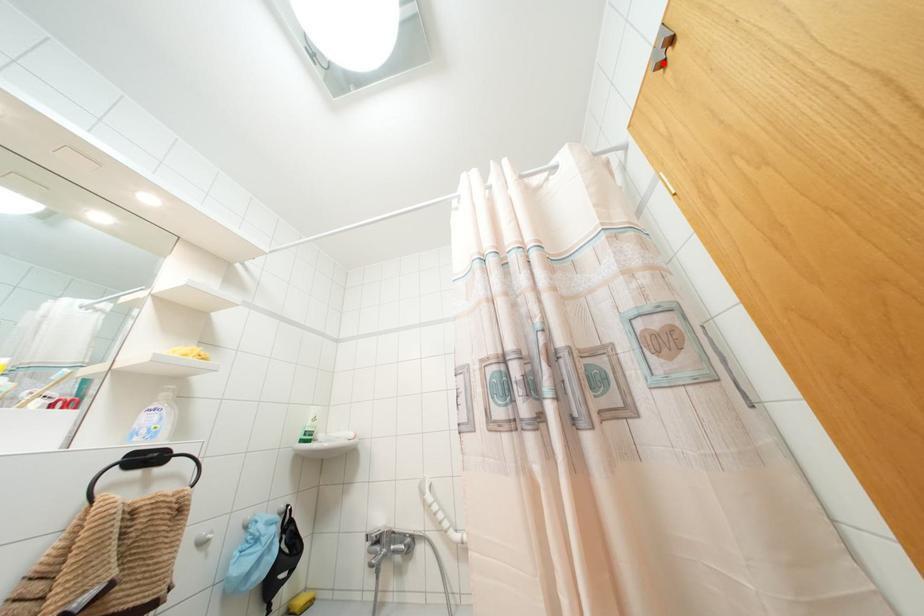
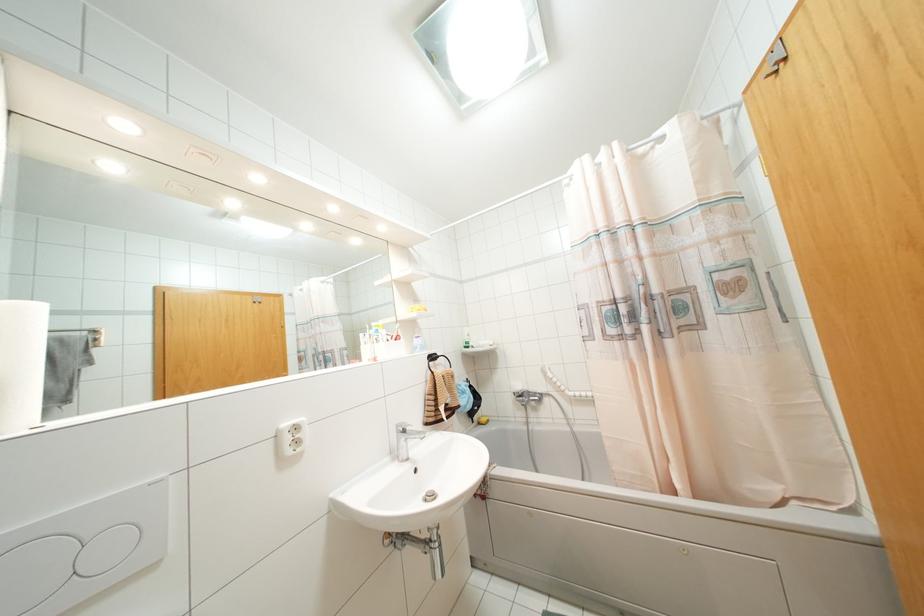
Find the pixel in the second image that matches the highlighted location in the first image.

(775, 71)